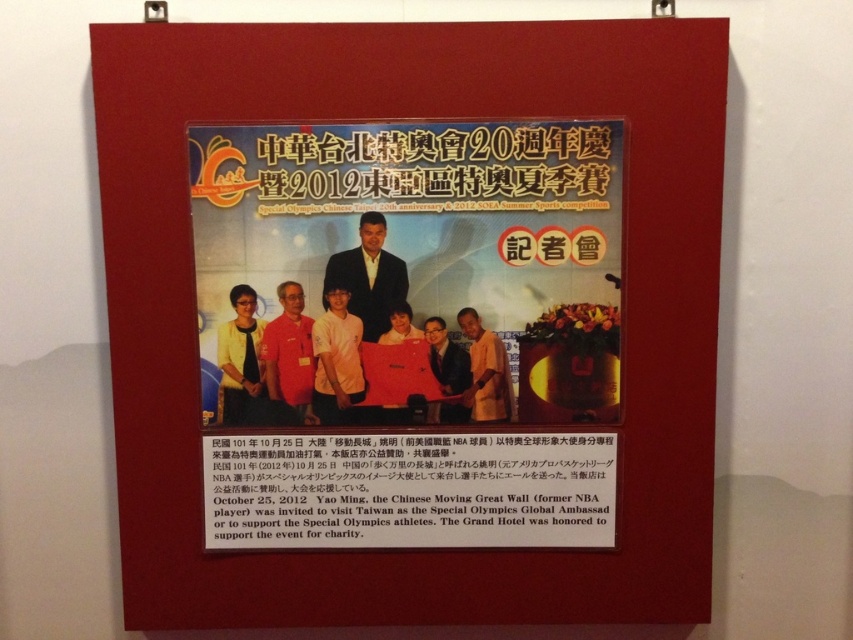
Question: Which object appears closest to the camera in this image?

Choices:
 (A) black paper at center
 (B) light brown fabric shirt at center
 (C) matte black jacket at center

Answer: (C)

Question: Which object appears farthest from the camera in this image?

Choices:
 (A) black paper at center
 (B) matte black jacket at center

Answer: (A)

Question: Is matte plastic bulletin board at center in front of light brown fabric shirt at center?

Choices:
 (A) no
 (B) yes

Answer: (B)

Question: Which of the following is the closest to the observer?

Choices:
 (A) matte black suit at center
 (B) matte black jacket at center
 (C) orange cotton shirt at center
 (D) matte plastic bulletin board at center

Answer: (D)

Question: Is matte plastic bulletin board at center smaller than black paper at center?

Choices:
 (A) no
 (B) yes

Answer: (A)

Question: Can you confirm if orange cotton shirt at center is positioned to the left of matte black jacket at center?

Choices:
 (A) yes
 (B) no

Answer: (A)